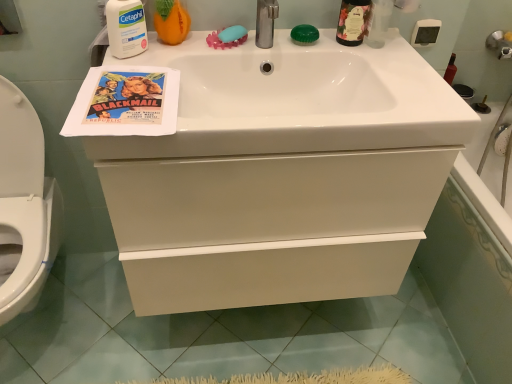
Where is `blank space to the left of green glossy soap at upper center, the 2th soap from the left`? blank space to the left of green glossy soap at upper center, the 2th soap from the left is located at coordinates (254, 41).